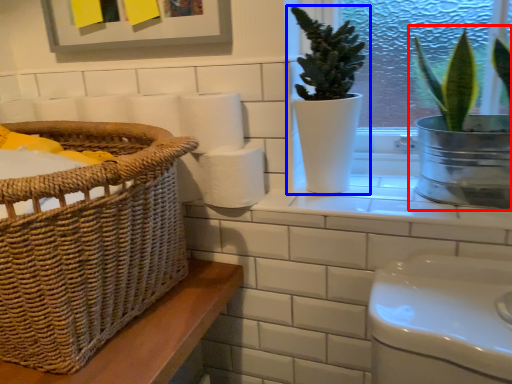
Question: Which object is further to the camera taking this photo, houseplant (highlighted by a red box) or houseplant (highlighted by a blue box)?

Choices:
 (A) houseplant
 (B) houseplant

Answer: (B)